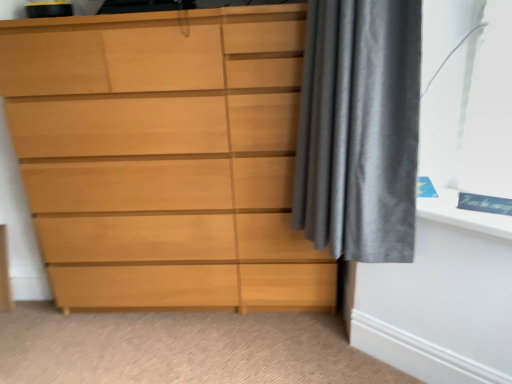
Question: Considering the positions of satin gray curtain at right and light wood chest of drawers at left in the image, is satin gray curtain at right bigger or smaller than light wood chest of drawers at left?

Choices:
 (A) small
 (B) big

Answer: (A)

Question: Considering the positions of point (349, 49) and point (22, 84), is point (349, 49) closer or farther from the camera than point (22, 84)?

Choices:
 (A) closer
 (B) farther

Answer: (A)

Question: From a real-world perspective, is satin gray curtain at right positioned above or below light wood chest of drawers at left?

Choices:
 (A) below
 (B) above

Answer: (B)

Question: Which is correct: light wood chest of drawers at left is inside satin gray curtain at right, or outside of it?

Choices:
 (A) inside
 (B) outside

Answer: (B)

Question: From the image's perspective, is light wood chest of drawers at left located above or below satin gray curtain at right?

Choices:
 (A) below
 (B) above

Answer: (A)

Question: In terms of height, does light wood chest of drawers at left look taller or shorter compared to satin gray curtain at right?

Choices:
 (A) short
 (B) tall

Answer: (B)

Question: In the image, is light wood chest of drawers at left positioned in front of or behind satin gray curtain at right?

Choices:
 (A) front
 (B) behind

Answer: (B)